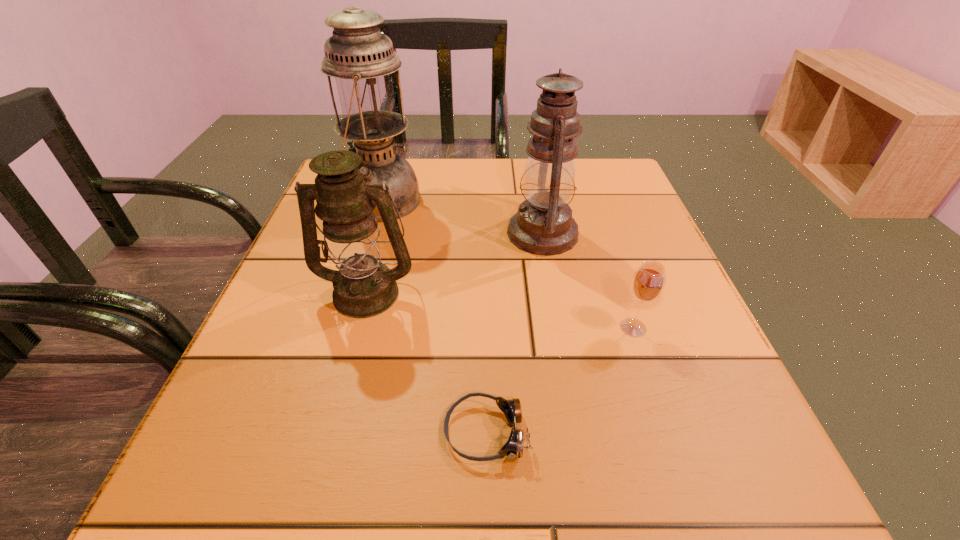
Locate an element on the screen. vacant position located 0.250m on the left of the fourth shortest object is located at coordinates (392, 233).

Identify the location of vacant position located on the front of the shortest oil lamp. tap(313, 488).

You are a GUI agent. You are given a task and a screenshot of the screen. Output one action in this format:
    pyautogui.click(x=<x>, y=<y>)
    Task: Click on the free location located on the back of the wineglass
    This screenshot has width=960, height=540.
    Given the screenshot: What is the action you would take?
    point(593,212)

Identify the location of free region located through the lenses of the nearest object. (243, 432).

Find the location of a particular element. The image size is (960, 540). vacant space situated through the lenses of the nearest object is located at coordinates (236, 432).

At what (x,y) coordinates should I click in order to perform the action: click on free point located 0.160m through the lenses of the nearest object. Please return your answer as a coordinate pair (x, y). Looking at the image, I should click on click(x=329, y=432).

The width and height of the screenshot is (960, 540). What are the coordinates of `object that is at the far edge` in the screenshot? It's located at (361, 59).

At what (x,y) coordinates should I click in order to perform the action: click on object located at the near edge. Please return your answer as a coordinate pair (x, y). Looking at the image, I should click on (513, 448).

The image size is (960, 540). Identify the location of object situated at the right edge. (648, 282).

In order to click on object at the far left corner in this screenshot , I will do `click(361, 59)`.